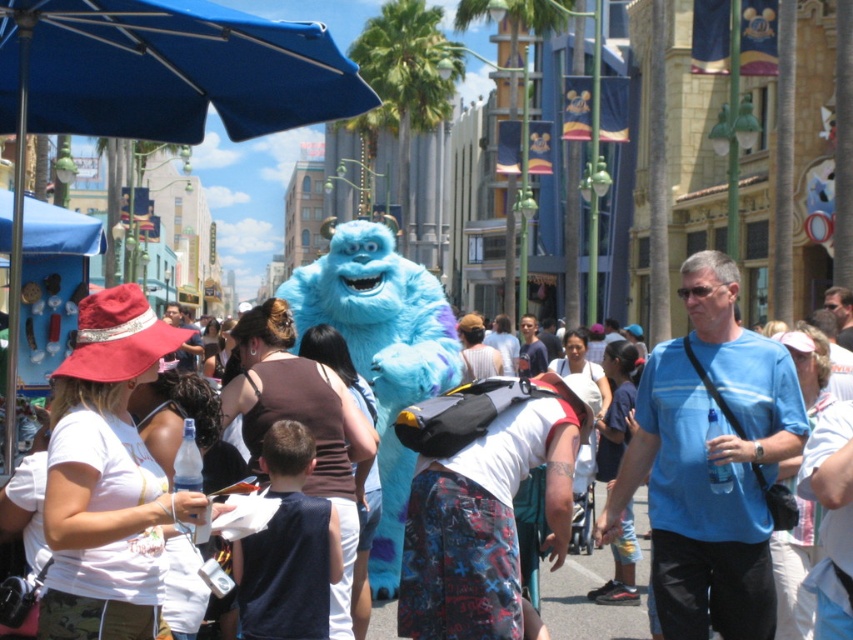
Question: From the image, what is the correct spatial relationship of white matte hat at left in relation to white cotton t-shirt at center?

Choices:
 (A) left
 (B) right

Answer: (A)

Question: Is dark blue fabric shirt at center smaller than fuzzy blue costume at center?

Choices:
 (A) no
 (B) yes

Answer: (B)

Question: Can you confirm if blue fabric umbrella at upper left is positioned to the left of white cotton t-shirt at center?

Choices:
 (A) yes
 (B) no

Answer: (A)

Question: Which object appears farthest from the camera in this image?

Choices:
 (A) blue fabric umbrella at upper left
 (B) white cotton t-shirt at center
 (C) dark blue fabric shirt at center
 (D) blue cotton shirt at center

Answer: (B)

Question: Which point appears farthest from the camera in this image?

Choices:
 (A) (641, 592)
 (B) (432, 458)
 (C) (103, 67)
 (D) (64, 429)

Answer: (A)

Question: Among these points, which one is nearest to the camera?

Choices:
 (A) (91, 26)
 (B) (541, 600)
 (C) (711, 614)
 (D) (299, 634)

Answer: (A)